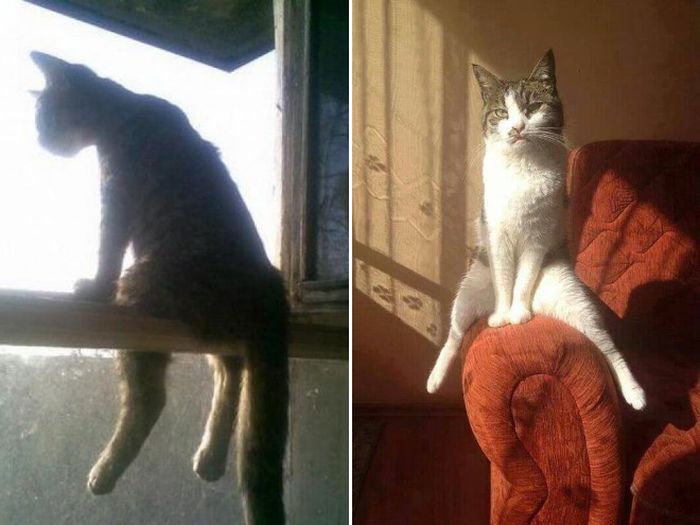
Identify the location of orange back of chair. The image size is (700, 525). (634, 225).